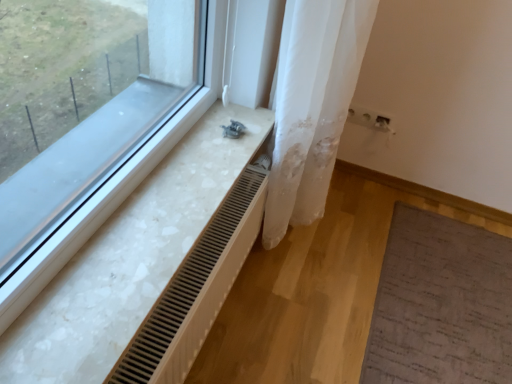
Question: From a real-world perspective, does white sheer fabric at center stand above white marble radiator at lower left?

Choices:
 (A) no
 (B) yes

Answer: (A)

Question: Is white sheer fabric at center completely or partially outside of white marble radiator at lower left?

Choices:
 (A) no
 (B) yes

Answer: (B)

Question: Is the position of white sheer fabric at center more distant than that of white marble radiator at lower left?

Choices:
 (A) no
 (B) yes

Answer: (B)

Question: Considering the relative positions of white sheer fabric at center and white marble radiator at lower left in the image provided, is white sheer fabric at center to the right of white marble radiator at lower left from the viewer's perspective?

Choices:
 (A) yes
 (B) no

Answer: (A)

Question: Is white sheer fabric at center wider than white marble radiator at lower left?

Choices:
 (A) yes
 (B) no

Answer: (B)

Question: From a real-world perspective, is white sheer fabric at center under white marble radiator at lower left?

Choices:
 (A) no
 (B) yes

Answer: (B)

Question: Does white marble radiator at lower left have a larger size compared to wooden radiator at lower left?

Choices:
 (A) yes
 (B) no

Answer: (B)

Question: Is white marble radiator at lower left wider than wooden radiator at lower left?

Choices:
 (A) yes
 (B) no

Answer: (A)

Question: Does white marble radiator at lower left have a smaller size compared to wooden radiator at lower left?

Choices:
 (A) yes
 (B) no

Answer: (A)

Question: Is white marble radiator at lower left to the right of wooden radiator at lower left from the viewer's perspective?

Choices:
 (A) yes
 (B) no

Answer: (B)

Question: From a real-world perspective, is white marble radiator at lower left below wooden radiator at lower left?

Choices:
 (A) no
 (B) yes

Answer: (A)

Question: Would you say white marble radiator at lower left is a long distance from wooden radiator at lower left?

Choices:
 (A) no
 (B) yes

Answer: (A)

Question: Is white marble radiator at lower left inside wooden radiator at lower left?

Choices:
 (A) yes
 (B) no

Answer: (B)